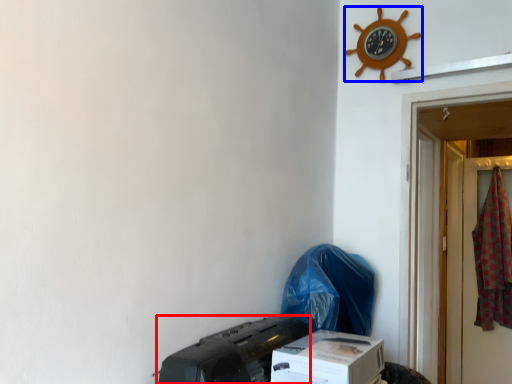
Question: Which of the following is the closest to the observer, printer (highlighted by a red box) or clock (highlighted by a blue box)?

Choices:
 (A) printer
 (B) clock

Answer: (A)